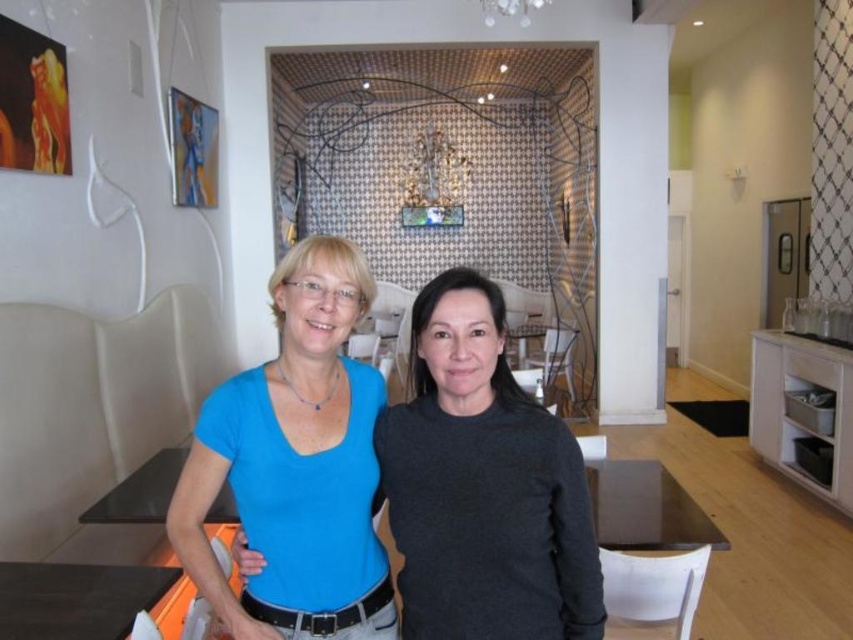
Question: Where is dark gray sweater at center located in relation to matte blue shirt at center in the image?

Choices:
 (A) right
 (B) left

Answer: (A)

Question: Is dark gray sweater at center wider than matte blue shirt at center?

Choices:
 (A) no
 (B) yes

Answer: (B)

Question: Is dark gray sweater at center positioned before matte blue shirt at center?

Choices:
 (A) no
 (B) yes

Answer: (B)

Question: Among these points, which one is nearest to the camera?

Choices:
 (A) (445, 588)
 (B) (310, 563)

Answer: (A)

Question: Among these points, which one is farthest from the camera?

Choices:
 (A) (292, 541)
 (B) (556, 588)
 (C) (74, 589)

Answer: (C)

Question: Which of the following is the farthest from the observer?

Choices:
 (A) (84, 608)
 (B) (556, 550)
 (C) (254, 625)

Answer: (A)